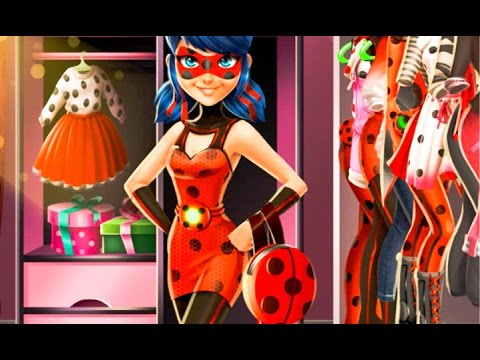
Image resolution: width=480 pixels, height=360 pixels. I want to click on pink drawer, so click(80, 280).